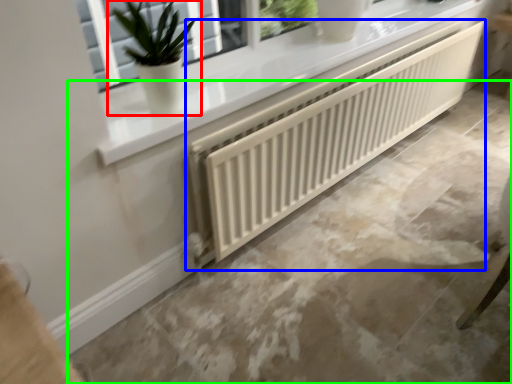
Question: Which object is the closest to the houseplant (highlighted by a red box)? Choose among these: radiator (highlighted by a blue box) or concrete (highlighted by a green box).

Choices:
 (A) radiator
 (B) concrete

Answer: (A)